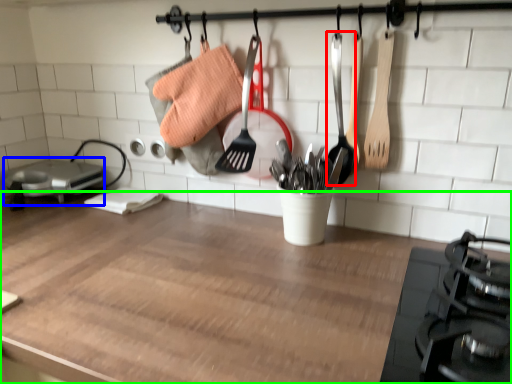
Question: Based on their relative distances, which object is nearer to utensil (highlighted by a red box)? Choose from appliance (highlighted by a blue box) and countertop (highlighted by a green box).

Choices:
 (A) appliance
 (B) countertop

Answer: (B)